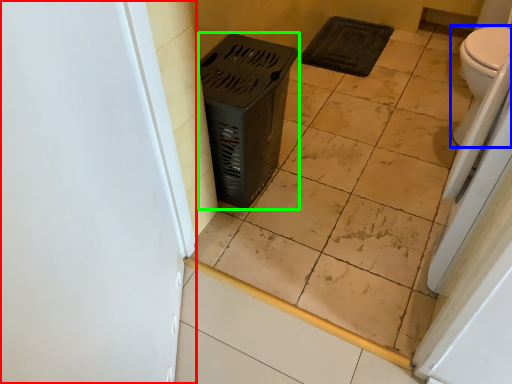
Question: Estimate the real-world distances between objects in this image. Which object is farther from screen door (highlighted by a red box), toilet (highlighted by a blue box) or laundry basket (highlighted by a green box)?

Choices:
 (A) toilet
 (B) laundry basket

Answer: (A)